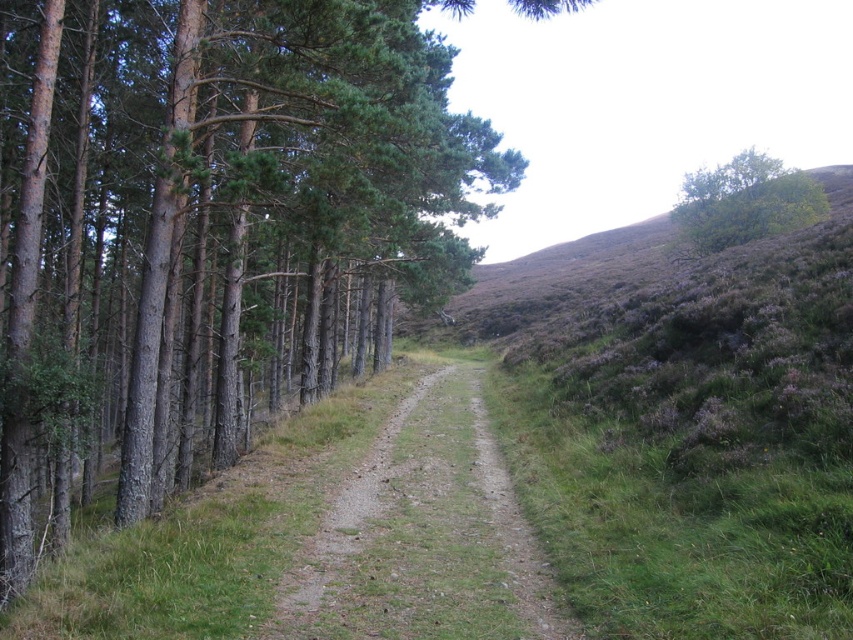
Question: Can you confirm if brown textured tree at left is positioned above green leafy tree at upper right?

Choices:
 (A) no
 (B) yes

Answer: (A)

Question: Is the position of brown textured tree at left less distant than that of green leafy tree at upper right?

Choices:
 (A) yes
 (B) no

Answer: (A)

Question: Estimate the real-world distances between objects in this image. Which object is farther from the dirt/gravel path at center?

Choices:
 (A) green leafy tree at upper right
 (B) brown textured tree at left

Answer: (A)

Question: Can you confirm if dirt/gravel path at center is positioned to the left of green leafy tree at upper right?

Choices:
 (A) yes
 (B) no

Answer: (A)

Question: Which object is closer to the camera taking this photo?

Choices:
 (A) dirt/gravel path at center
 (B) green leafy tree at upper right
 (C) brown textured tree at left

Answer: (A)

Question: Which object is positioned closest to the dirt/gravel path at center?

Choices:
 (A) green leafy tree at upper right
 (B) brown textured tree at left

Answer: (B)